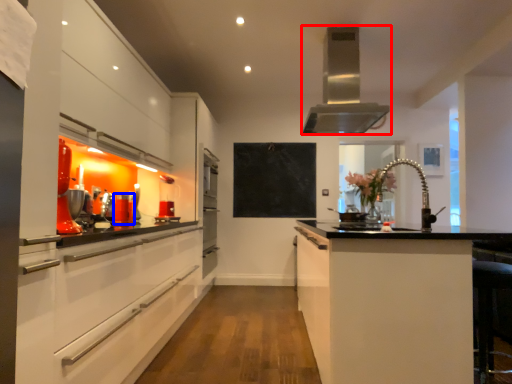
Question: Which object is further to the camera taking this photo, home appliance (highlighted by a red box) or appliance (highlighted by a blue box)?

Choices:
 (A) home appliance
 (B) appliance

Answer: (A)